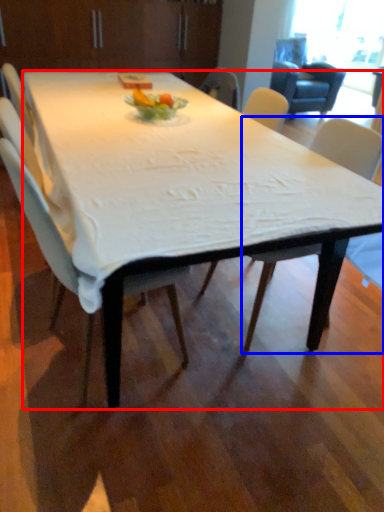
Question: Which point is closer to the camera, desk (highlighted by a red box) or chair (highlighted by a blue box)?

Choices:
 (A) desk
 (B) chair

Answer: (A)